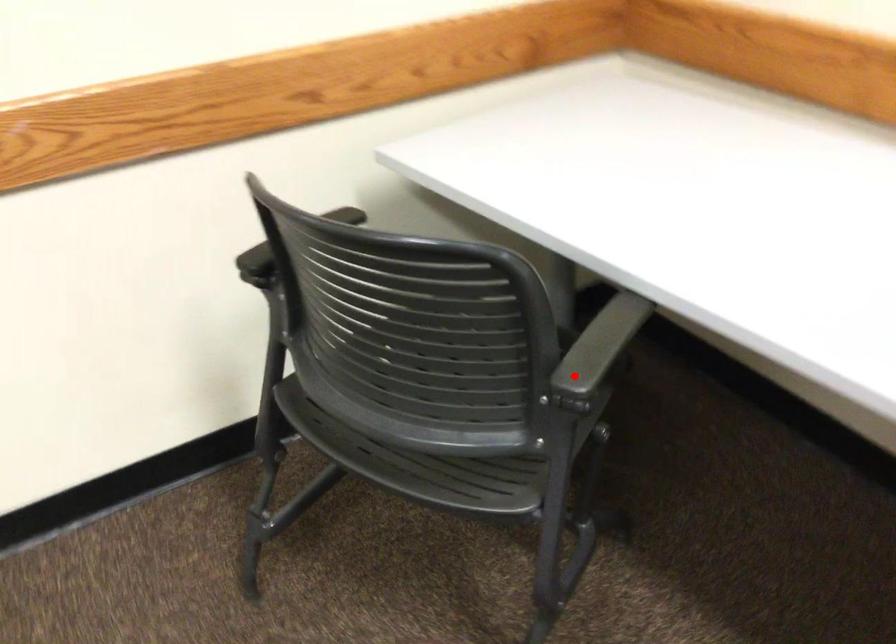
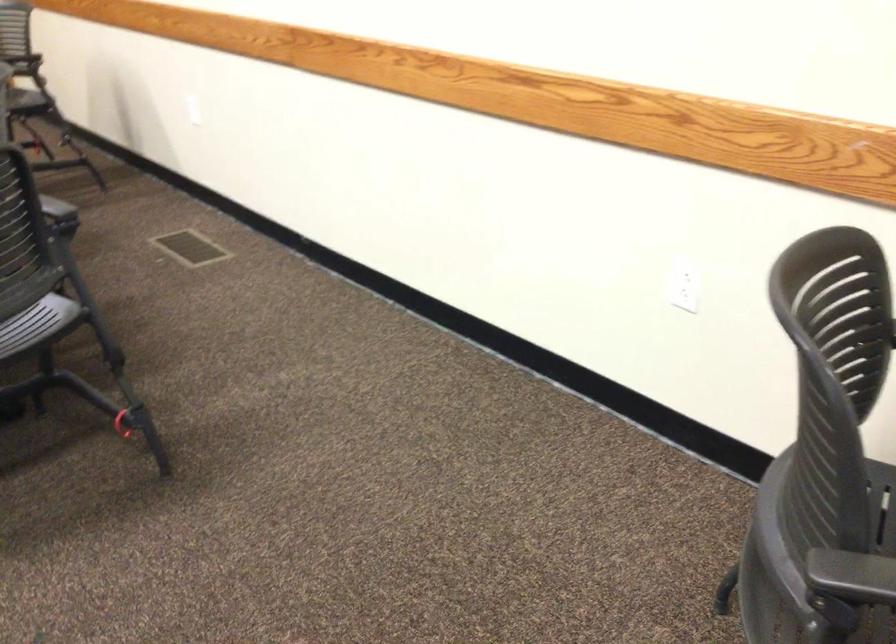
Find the pixel in the second image that matches the highlighted location in the first image.

(850, 573)